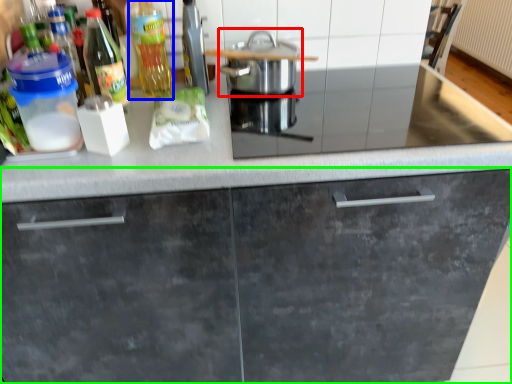
Question: Estimate the real-world distances between objects in this image. Which object is farther from home appliance (highlighted by a red box), bottle (highlighted by a blue box) or cabinetry (highlighted by a green box)?

Choices:
 (A) bottle
 (B) cabinetry

Answer: (B)